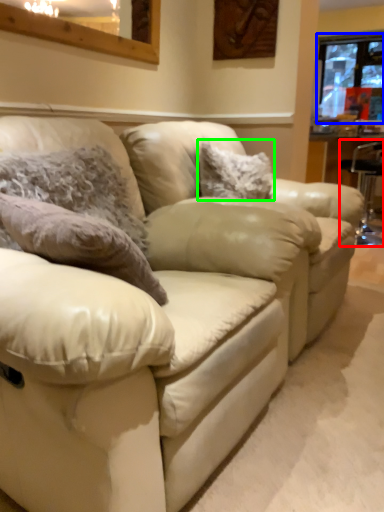
Question: Which object is positioned farthest from bar stool (highlighted by a red box)? Select from window (highlighted by a blue box) and pillow (highlighted by a green box).

Choices:
 (A) window
 (B) pillow

Answer: (A)